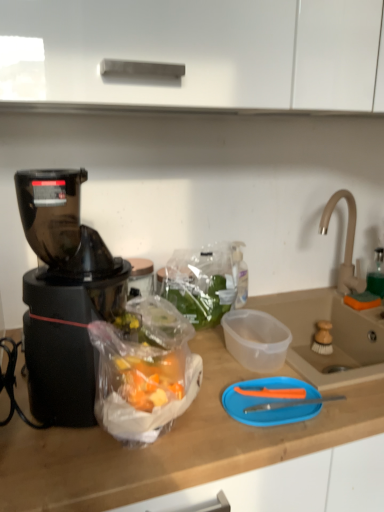
Question: Is white matte cabinet at upper center aimed at blue plastic cutting board at center?

Choices:
 (A) yes
 (B) no

Answer: (B)

Question: Is white matte cabinet at upper center smaller than blue plastic cutting board at center?

Choices:
 (A) no
 (B) yes

Answer: (A)

Question: Is white matte cabinet at upper center further to camera compared to blue plastic cutting board at center?

Choices:
 (A) no
 (B) yes

Answer: (A)

Question: Considering the relative sizes of white matte cabinet at upper center and blue plastic cutting board at center in the image provided, is white matte cabinet at upper center bigger than blue plastic cutting board at center?

Choices:
 (A) yes
 (B) no

Answer: (A)

Question: Can you confirm if white matte cabinet at upper center is wider than blue plastic cutting board at center?

Choices:
 (A) yes
 (B) no

Answer: (A)

Question: Is white matte cabinet at upper center oriented away from blue plastic cutting board at center?

Choices:
 (A) no
 (B) yes

Answer: (A)

Question: Is transparent plastic sink at right, arranged as the second sink when viewed from the top, not inside black plastic blender at left?

Choices:
 (A) yes
 (B) no

Answer: (A)

Question: From a real-world perspective, is transparent plastic sink at right, acting as the 1th sink starting from the bottom, physically above black plastic blender at left?

Choices:
 (A) no
 (B) yes

Answer: (A)

Question: Is there a large distance between transparent plastic sink at right, arranged as the second sink when viewed from the top, and black plastic blender at left?

Choices:
 (A) yes
 (B) no

Answer: (B)

Question: Is transparent plastic sink at right, acting as the 1th sink starting from the bottom, smaller than black plastic blender at left?

Choices:
 (A) no
 (B) yes

Answer: (B)

Question: Does transparent plastic sink at right, acting as the 1th sink starting from the bottom, come in front of black plastic blender at left?

Choices:
 (A) no
 (B) yes

Answer: (A)

Question: Is the surface of transparent plastic sink at right, arranged as the second sink when viewed from the top, in direct contact with black plastic blender at left?

Choices:
 (A) no
 (B) yes

Answer: (A)

Question: Is black plastic blender at left facing away from white matte cabinet at upper center?

Choices:
 (A) yes
 (B) no

Answer: (B)